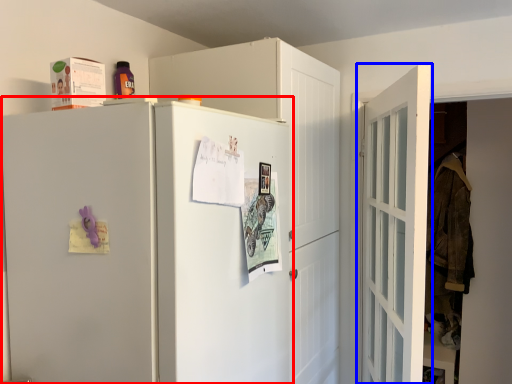
Question: Which of the following is the farthest to the observer, refrigerator (highlighted by a red box) or door (highlighted by a blue box)?

Choices:
 (A) refrigerator
 (B) door

Answer: (B)